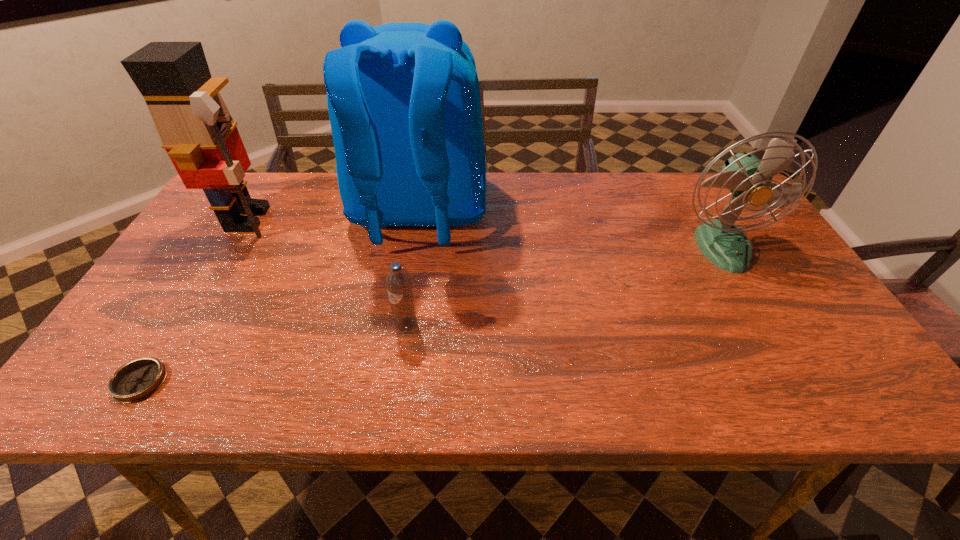
Where is `object situated at the near left corner`? object situated at the near left corner is located at coordinates (138, 379).

Image resolution: width=960 pixels, height=540 pixels. In the image, there is a desktop. Find the location of `vacant space at the far edge`. vacant space at the far edge is located at coordinates (627, 178).

Where is `vacant space at the left edge`? This screenshot has width=960, height=540. vacant space at the left edge is located at coordinates (180, 254).

I want to click on vacant region at the right edge of the desktop, so click(800, 294).

I want to click on vacant space at the far right corner of the desktop, so click(x=748, y=213).

Identify the location of vacant area that lies between the backpack and the second nearest object. (413, 269).

Image resolution: width=960 pixels, height=540 pixels. I want to click on blank region between the fan and the second shortest object, so click(564, 286).

You are a GUI agent. You are given a task and a screenshot of the screen. Output one action in this format:
    pyautogui.click(x=<x>, y=<y>)
    Task: Click on the vacant area between the compass and the nutcracker
    This screenshot has height=540, width=960.
    Given the screenshot: What is the action you would take?
    pyautogui.click(x=194, y=300)

Where is `free space between the backpack and the rightmost object`? free space between the backpack and the rightmost object is located at coordinates (570, 230).

This screenshot has width=960, height=540. I want to click on empty space that is in between the rightmost object and the fourth tallest object, so click(x=564, y=286).